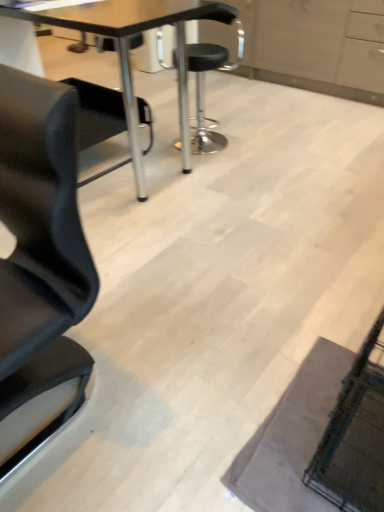
Image resolution: width=384 pixels, height=512 pixels. Describe the element at coordinates (128, 51) in the screenshot. I see `matte black table at center` at that location.

In order to face matte black table at center, should I rotate leftwards or rightwards?

To align with it, rotate left about 13.605°.

Locate an element on the screen. The width and height of the screenshot is (384, 512). matte black table at center is located at coordinates (128, 51).

Identify the location of black leather stool at center. (202, 89).

What is the approximate height of black leather stool at center?

black leather stool at center is 85.47 centimeters tall.

Describe the element at coordinates (202, 89) in the screenshot. I see `black leather stool at center` at that location.

You are a GUI agent. You are given a task and a screenshot of the screen. Output one action in this format:
    pyautogui.click(x=<x>, y=<y>)
    Task: Click on the matte black table at center
    
    Given the screenshot: What is the action you would take?
    pyautogui.click(x=128, y=51)

From the picture: Considering the positions of objects black leather stool at center and matte black table at center in the image provided, who is more to the right, black leather stool at center or matte black table at center?

From the viewer's perspective, black leather stool at center appears more on the right side.

Is black leather stool at center further to the viewer compared to matte black table at center?

Yes, black leather stool at center is further from the viewer.

Is point (237, 59) farther from camera compared to point (132, 156)?

Yes, it is.

From the image's perspective, is black leather stool at center located above or below matte black table at center?

Based on their image positions, black leather stool at center is located above matte black table at center.

From a real-world perspective, is black leather stool at center over matte black table at center?

Actually, black leather stool at center is physically below matte black table at center in the real world.

Which of these two, black leather stool at center or matte black table at center, is thinner?

With smaller width is black leather stool at center.

Considering the sizes of objects black leather stool at center and matte black table at center in the image provided, who is shorter, black leather stool at center or matte black table at center?

With less height is black leather stool at center.

In the scene shown: Is black leather stool at center bigger or smaller than matte black table at center?

black leather stool at center is smaller than matte black table at center.

Is black leather stool at center not within matte black table at center?

Yes, black leather stool at center is located beyond the bounds of matte black table at center.

Are black leather stool at center and matte black table at center making contact?

No, black leather stool at center is not in contact with matte black table at center.

Is black leather stool at center turned away from matte black table at center?

No, black leather stool at center's orientation is not away from matte black table at center.

Consider the image. Can you tell me how much black leather stool at center and matte black table at center differ in facing direction?

They differ by 33.2 degrees in their facing directions.

The image size is (384, 512). Identify the location of table located in front of the black leather stool at center. click(x=128, y=51).

Is matte black table at center at the left side of black leather stool at center?

Yes, matte black table at center is to the left of black leather stool at center.

Looking at this image, between matte black table at center and black leather stool at center, which one is positioned in front?

matte black table at center is in front.

Between point (142, 176) and point (205, 120), which one is positioned in front?

Positioned in front is point (142, 176).

From the picture: From the image's perspective, is matte black table at center on black leather stool at center?

No, from the image's perspective, matte black table at center is not above black leather stool at center.

From a real-world perspective, is matte black table at center above or below black leather stool at center?

matte black table at center is situated higher than black leather stool at center in the real world.

In terms of width, does matte black table at center look wider or thinner when compared to black leather stool at center?

In the image, matte black table at center appears to be wider than black leather stool at center.

Which of these two, matte black table at center or black leather stool at center, stands shorter?

With less height is black leather stool at center.

Does matte black table at center have a smaller size compared to black leather stool at center?

No, matte black table at center is not smaller than black leather stool at center.

Is matte black table at center situated inside black leather stool at center or outside?

matte black table at center is outside black leather stool at center.

Is matte black table at center beside black leather stool at center?

No, matte black table at center is not touching black leather stool at center.

Based on the photo, could you tell me if matte black table at center is facing black leather stool at center?

No, matte black table at center does not turn towards black leather stool at center.

The width and height of the screenshot is (384, 512). What are the coordinates of `chair behind the matte black table at center` in the screenshot? It's located at (202, 89).

This screenshot has width=384, height=512. I want to click on table that is in front of the black leather stool at center, so click(x=128, y=51).

This screenshot has width=384, height=512. What are the coordinates of `table that appears on the left of black leather stool at center` in the screenshot? It's located at 128,51.